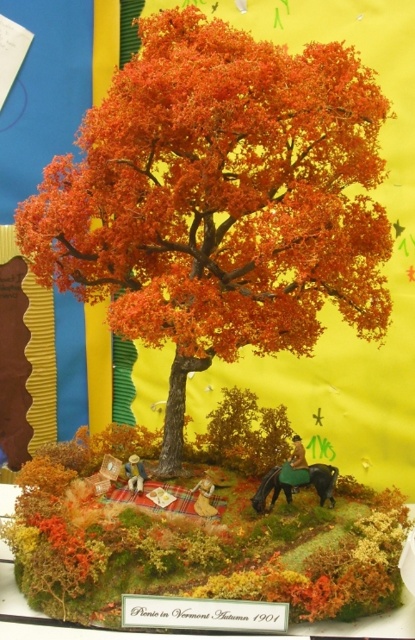
Question: Does orange matte tree at center appear under green felt horse at center?

Choices:
 (A) no
 (B) yes

Answer: (A)

Question: Does orange matte tree at center appear on the right side of green felt horse at center?

Choices:
 (A) no
 (B) yes

Answer: (A)

Question: Considering the relative positions of orange matte tree at center and green felt horse at center in the image provided, where is orange matte tree at center located with respect to green felt horse at center?

Choices:
 (A) right
 (B) left

Answer: (B)

Question: Which of the following is the closest to the observer?

Choices:
 (A) orange matte tree at center
 (B) green felt horse at center

Answer: (A)

Question: Among these points, which one is nearest to the camera?

Choices:
 (A) (173, 189)
 (B) (332, 502)

Answer: (A)